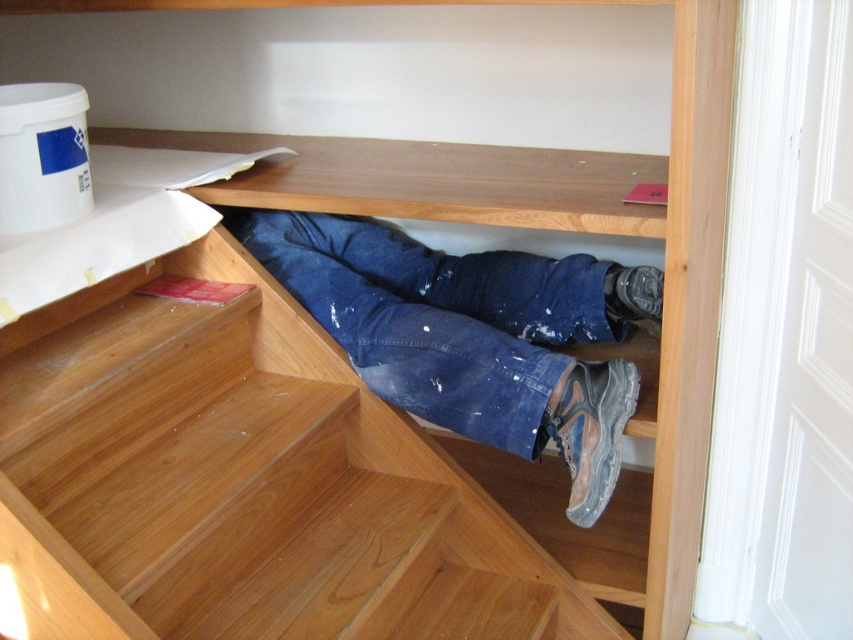
Which of these two, wooden stairs at center or blue jeans at center, stands taller?

wooden stairs at center

Image resolution: width=853 pixels, height=640 pixels. What do you see at coordinates (241, 484) in the screenshot? I see `wooden stairs at center` at bounding box center [241, 484].

Which is in front, point (322, 483) or point (418, 244)?

Point (322, 483) is in front.

Identify the location of wooden stairs at center. This screenshot has width=853, height=640. (241, 484).